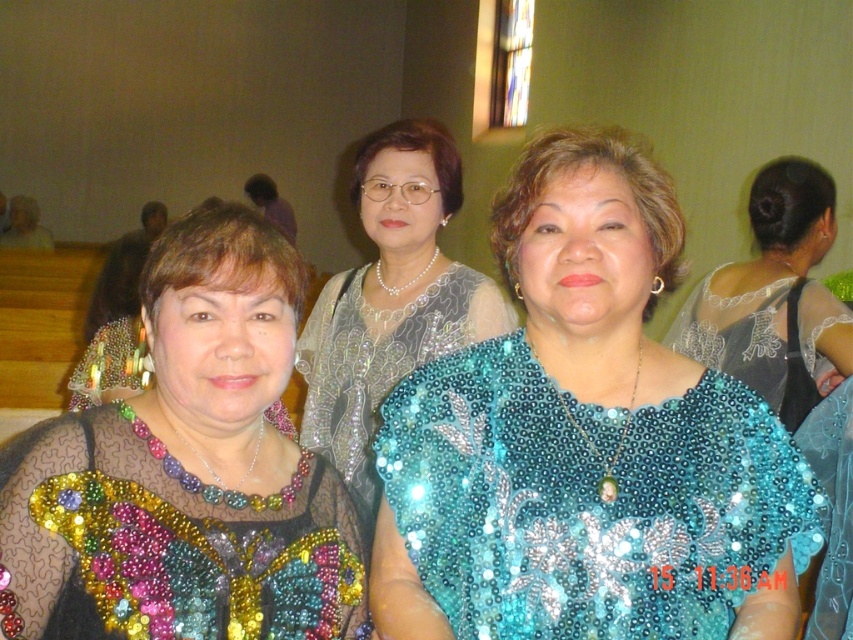
What do you see at coordinates (585, 442) in the screenshot? I see `teal sequined blouse at center` at bounding box center [585, 442].

Can you confirm if teal sequined blouse at center is taller than multicolored sequined blouse at center?

Indeed, teal sequined blouse at center has a greater height compared to multicolored sequined blouse at center.

Between point (527, 285) and point (198, 547), which one is positioned in front?

Point (198, 547) is in front.

Image resolution: width=853 pixels, height=640 pixels. I want to click on teal sequined blouse at center, so click(x=585, y=442).

Who is more forward, (253,580) or (430,248)?

Positioned in front is point (253,580).

This screenshot has height=640, width=853. What are the coordinates of `beaded fabric dress at center` in the screenshot? It's located at (181, 541).

Does teal sequined blouse at center come in front of teal sequined dress at center?

Yes, teal sequined blouse at center is closer to the viewer.

How far apart are teal sequined blouse at center and teal sequined dress at center?

The distance of teal sequined blouse at center from teal sequined dress at center is 4.22 feet.

Is point (595, 636) in front of point (786, 372)?

Yes, it is in front of point (786, 372).

What are the coordinates of `teal sequined blouse at center` in the screenshot? It's located at (585, 442).